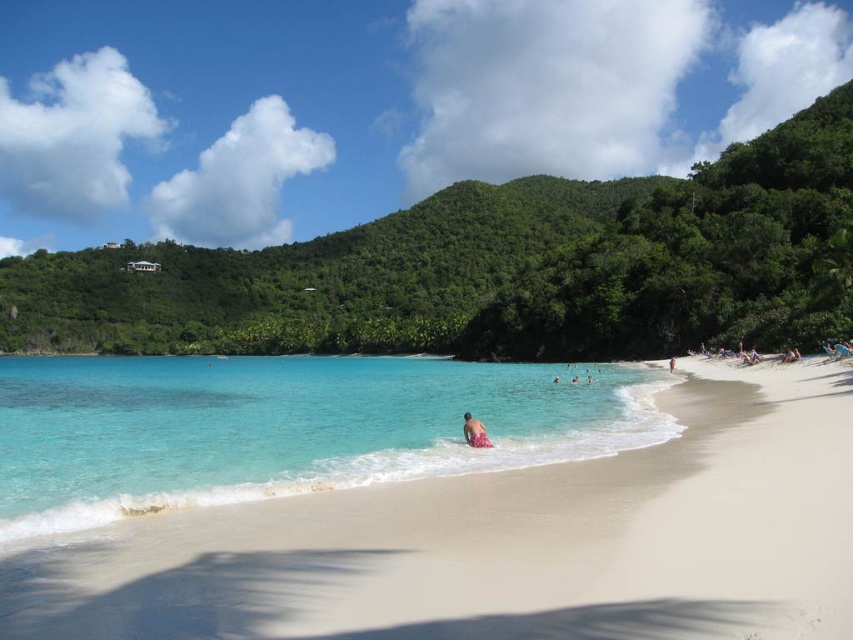
You are standing on the beach and want to take a photo of the point at coordinates (659, 378). Considering the distance, will you need to zoom in your camera to capture it clearly?

The point at coordinates (659, 378) is 62.22 meters away from the camera. To capture it clearly, you would need to zoom in your camera to account for the distance.

You are standing on the beach and want to take a photo of the clear blue water at center. Where should you aim your camera to capture it?

You should aim your camera at point coordinates (285, 428) to capture the clear blue water at center.